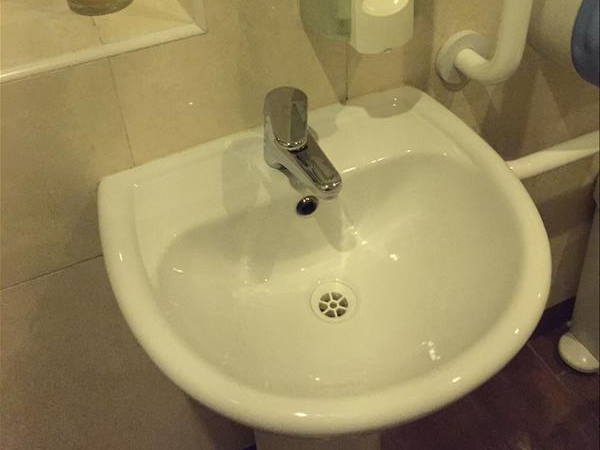
Where is `tile`? The image size is (600, 450). tile is located at coordinates (205, 117).